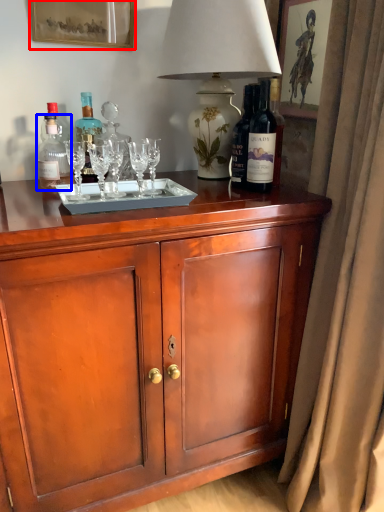
Question: Which of the following is the farthest to the observer, picture frame (highlighted by a red box) or bottle (highlighted by a blue box)?

Choices:
 (A) picture frame
 (B) bottle

Answer: (A)